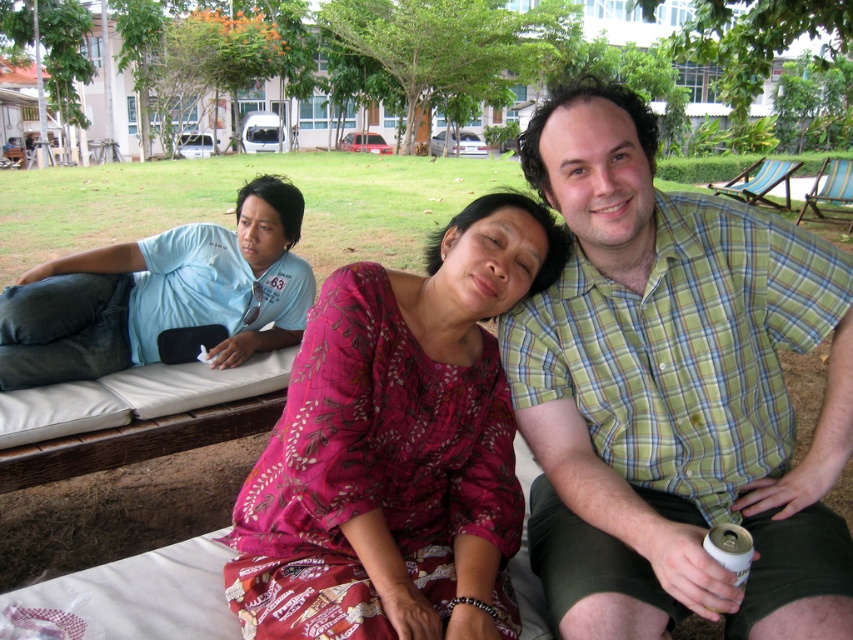
You are standing in front of the scene and want to know which of the two points, point (x=453, y=237) or point (x=136, y=349), is closer to you. Based on the image, which point is nearer?

Point (x=453, y=237) is closer to the camera than point (x=136, y=349), so it is the nearer point.

In the scene shown: You are standing 5 feet away from the camera. You want to take a photo of the green plaid shirt at center. Can you reach it with a selfie stick that extends up to 2 feet?

The green plaid shirt at center is 3.37 feet away from the camera. Since you are 5 feet away from the camera, the total distance between you and the green plaid shirt at center is 5 feet minus 3.37 feet equals 1.63 feet. The selfie stick can extend up to 2 feet, so yes, you can reach the green plaid shirt at center.